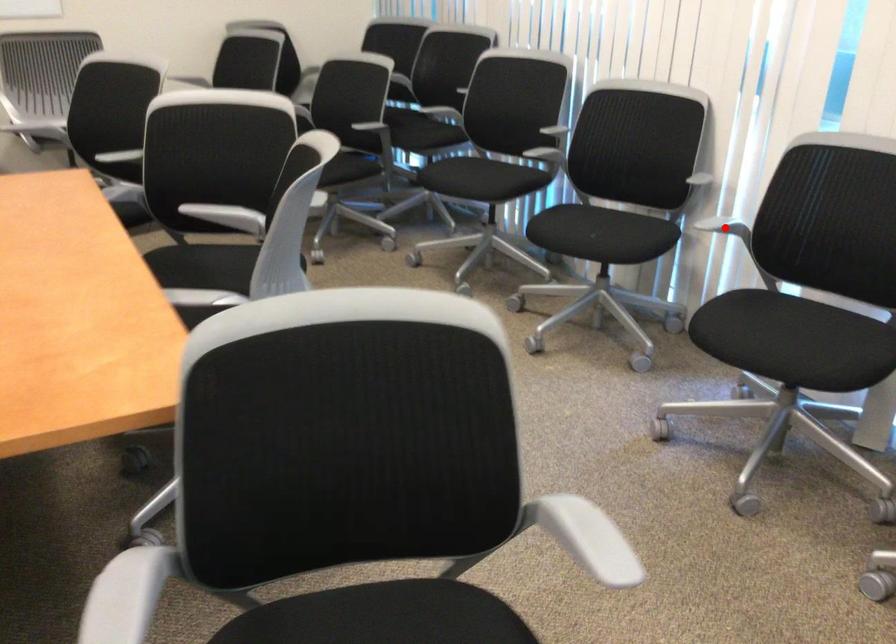
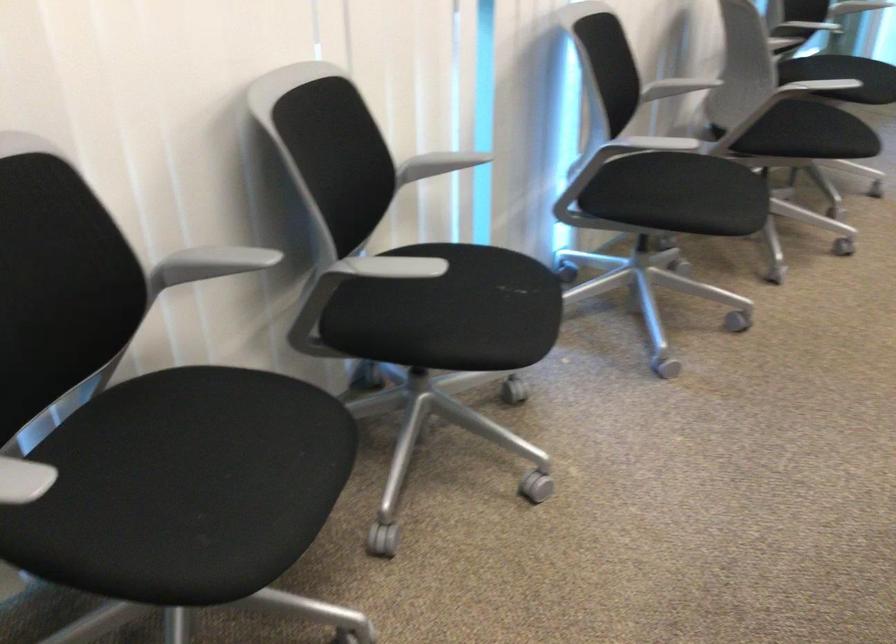
Question: I am providing you with two images of the same scene from different viewpoints. A red point is marked on the first image. At the location where the point appears in image 1, is it still visible in image 2?

Choices:
 (A) Yes
 (B) No

Answer: (B)